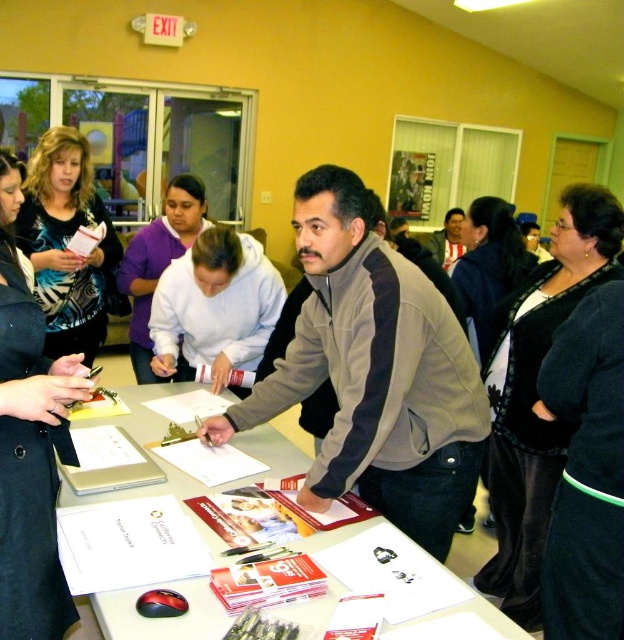
Question: Is black textured sweater at center bigger than matte gray jacket at center?

Choices:
 (A) no
 (B) yes

Answer: (B)

Question: Which object appears farthest from the camera in this image?

Choices:
 (A) black textured dress at center
 (B) black textured sweater at center
 (C) matte gray jacket at center
 (D) matte black jacket at upper left

Answer: (C)

Question: Can you confirm if white paper at center is positioned below white fleece hoodie at center?

Choices:
 (A) yes
 (B) no

Answer: (A)

Question: Which point appears closest to the camera in this image?

Choices:
 (A) (431, 236)
 (B) (177, 392)
 (C) (137, 307)
 (D) (76, 317)

Answer: (B)

Question: Is black textured dress at center further to camera compared to matte gray jacket at center?

Choices:
 (A) no
 (B) yes

Answer: (A)

Question: Estimate the real-world distances between objects in this image. Which object is farther from the black textured sweater at center?

Choices:
 (A) purple fleece at center
 (B) gray fleece jacket at center
 (C) matte black jacket at upper left

Answer: (C)